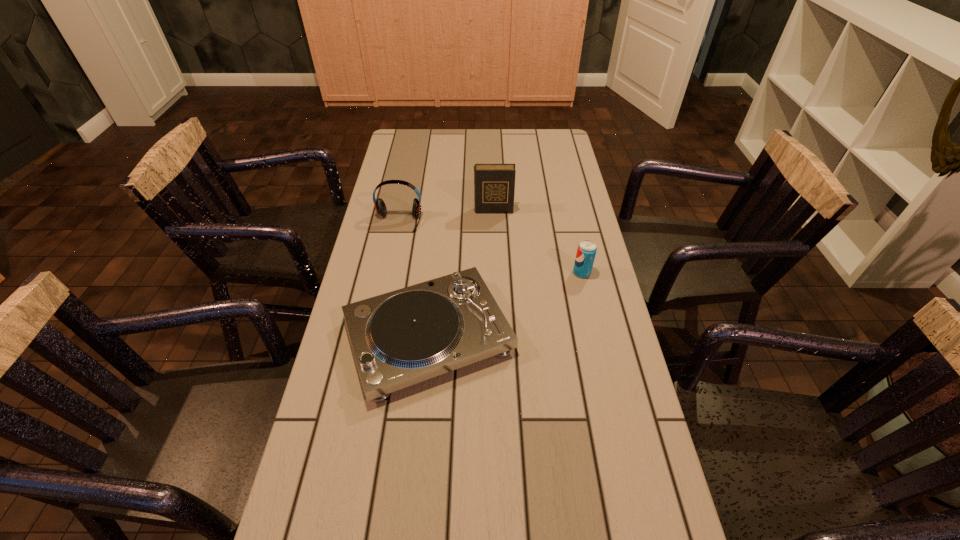
Where is `unoccupied area between the shortest object and the second nearest object`? unoccupied area between the shortest object and the second nearest object is located at coordinates (505, 305).

I want to click on vacant point located between the third shortest object and the record player, so click(414, 279).

I want to click on vacant space in between the third tallest object and the tallest object, so pyautogui.click(x=538, y=241).

I want to click on unoccupied area between the shortest object and the third shortest object, so click(x=414, y=279).

Identify the location of empty space between the third shortest object and the tallest object. (x=446, y=216).

Locate which object ranks in proximity to the nearest object. Please provide its 2D coordinates. Your answer should be formatted as a tuple, i.e. [(x, y)], where the tuple contains the x and y coordinates of a point satisfying the conditions above.

[(586, 251)]

Locate which object ranks third in proximity to the third farthest object. Please provide its 2D coordinates. Your answer should be formatted as a tuple, i.e. [(x, y)], where the tuple contains the x and y coordinates of a point satisfying the conditions above.

[(380, 206)]

This screenshot has width=960, height=540. I want to click on free space that satisfies the following two spatial constraints: 1. with the microphone attached to the side of the rightmost object; 2. on the right side of the third shortest object, so click(x=388, y=273).

Image resolution: width=960 pixels, height=540 pixels. I want to click on vacant space that satisfies the following two spatial constraints: 1. with the microphone attached to the side of the headset; 2. on the right side of the shortest object, so click(375, 336).

Locate an element on the screen. free space that satisfies the following two spatial constraints: 1. on the back side of the record player; 2. on the left side of the rightmost object is located at coordinates (435, 273).